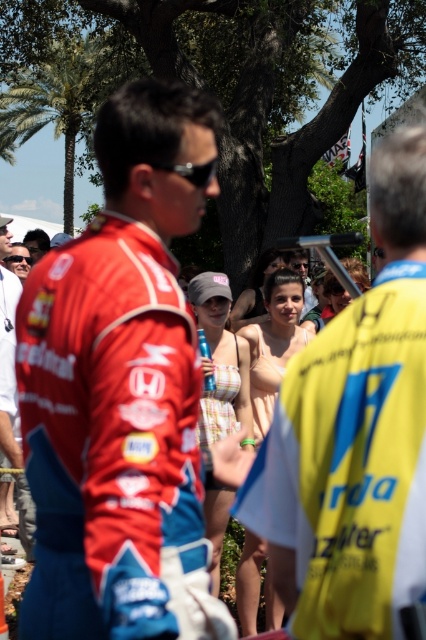
Does green leafy palm tree at upper left have a lesser width compared to matte black sunglasses at center?

No.

Who is more forward, (3,97) or (25,257)?

Point (25,257) is more forward.

Describe the element at coordinates (57, 104) in the screenshot. This screenshot has width=426, height=640. I see `green leafy palm tree at upper left` at that location.

This screenshot has width=426, height=640. What are the coordinates of `green leafy palm tree at upper left` in the screenshot? It's located at (57, 104).

Who is lower down, black matte sunglasses at center or matte black sunglasses at center?

black matte sunglasses at center

Does black matte sunglasses at center appear under matte black sunglasses at center?

Correct, black matte sunglasses at center is located below matte black sunglasses at center.

What do you see at coordinates (190, 170) in the screenshot?
I see `black matte sunglasses at center` at bounding box center [190, 170].

At what (x,y) coordinates should I click in order to perform the action: click on black matte sunglasses at center. Please return your answer as a coordinate pair (x, y). Looking at the image, I should click on (190, 170).

Can you confirm if red fabric racing suit at center is shorter than black matte sunglasses at center?

No, red fabric racing suit at center is not shorter than black matte sunglasses at center.

This screenshot has height=640, width=426. What do you see at coordinates (120, 392) in the screenshot?
I see `red fabric racing suit at center` at bounding box center [120, 392].

The height and width of the screenshot is (640, 426). What do you see at coordinates (120, 392) in the screenshot? I see `red fabric racing suit at center` at bounding box center [120, 392].

The height and width of the screenshot is (640, 426). Find the location of `red fabric racing suit at center`. red fabric racing suit at center is located at coordinates (120, 392).